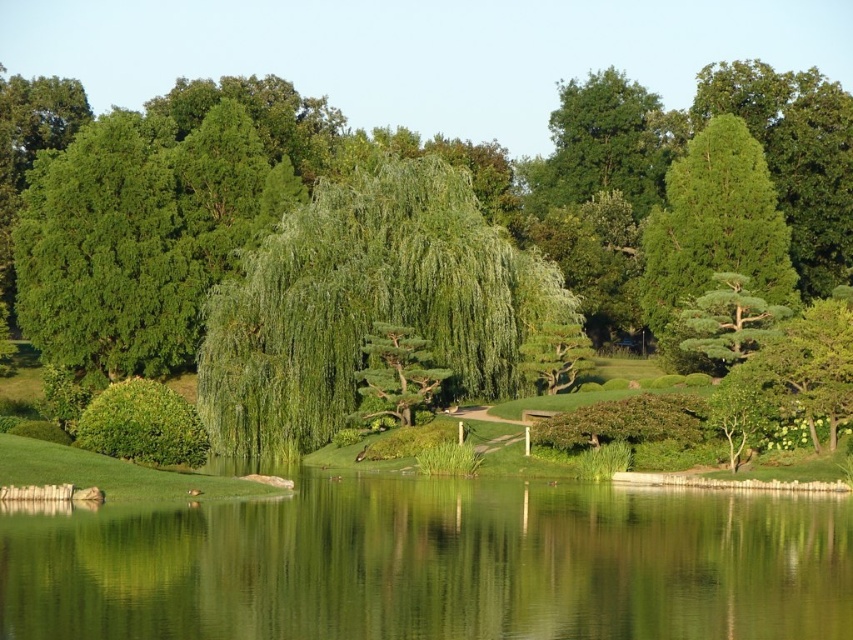
Question: Which object is the farthest from the green textured tree at upper right?

Choices:
 (A) green leafy tree at center
 (B) green leafy willow at center
 (C) green reflective water at center

Answer: (C)

Question: Is green leafy tree at center bigger than green leafy willow at center?

Choices:
 (A) no
 (B) yes

Answer: (B)

Question: Is green leafy willow at center positioned behind green textured tree at upper right?

Choices:
 (A) yes
 (B) no

Answer: (B)

Question: Considering the real-world distances, which object is farthest from the green textured tree at upper right?

Choices:
 (A) green leafy willow at center
 (B) green leafy tree at center
 (C) green reflective water at center

Answer: (C)

Question: Which object is farther from the camera taking this photo?

Choices:
 (A) green leafy tree at center
 (B) green leafy willow at center
 (C) green reflective water at center

Answer: (A)

Question: Is green leafy tree at center bigger than green textured tree at upper right?

Choices:
 (A) yes
 (B) no

Answer: (A)